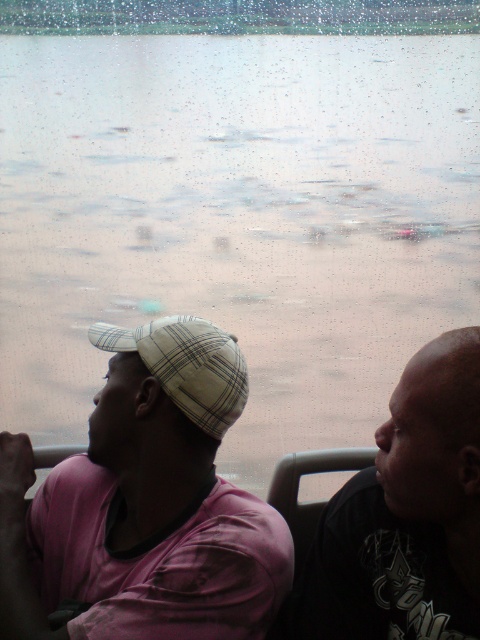
Question: Which object is the farthest from the dark gray matte shirt at right?

Choices:
 (A) plaid fabric baseball cap at left
 (B) plaid fabric cap at left

Answer: (A)

Question: Considering the real-world distances, which object is farthest from the plaid fabric cap at left?

Choices:
 (A) dark gray matte shirt at right
 (B) plaid fabric baseball cap at left

Answer: (A)

Question: Does plaid fabric cap at left lie behind plaid fabric baseball cap at left?

Choices:
 (A) no
 (B) yes

Answer: (A)

Question: Which object is closer to the camera taking this photo?

Choices:
 (A) plaid fabric cap at left
 (B) plaid fabric baseball cap at left

Answer: (A)

Question: Can you confirm if plaid fabric cap at left is smaller than dark gray matte shirt at right?

Choices:
 (A) no
 (B) yes

Answer: (A)

Question: Is plaid fabric cap at left positioned at the back of dark gray matte shirt at right?

Choices:
 (A) no
 (B) yes

Answer: (B)